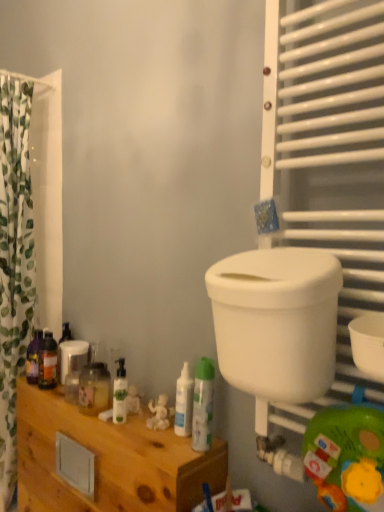
Locate an element on the screen. Image resolution: width=384 pixels, height=512 pixels. free space in front of white glossy pump bottle at center, which appears as the third toiletry when viewed from the front is located at coordinates (138, 436).